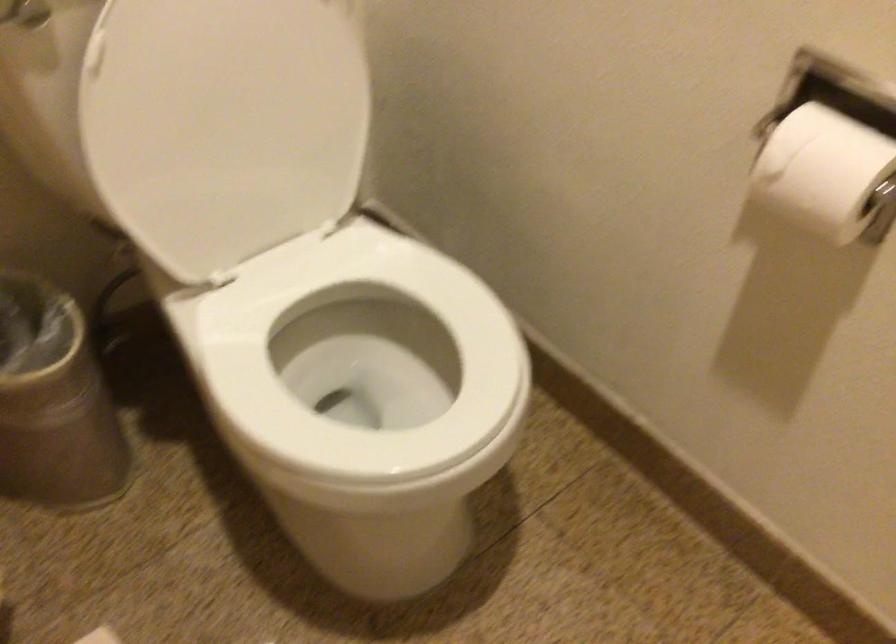
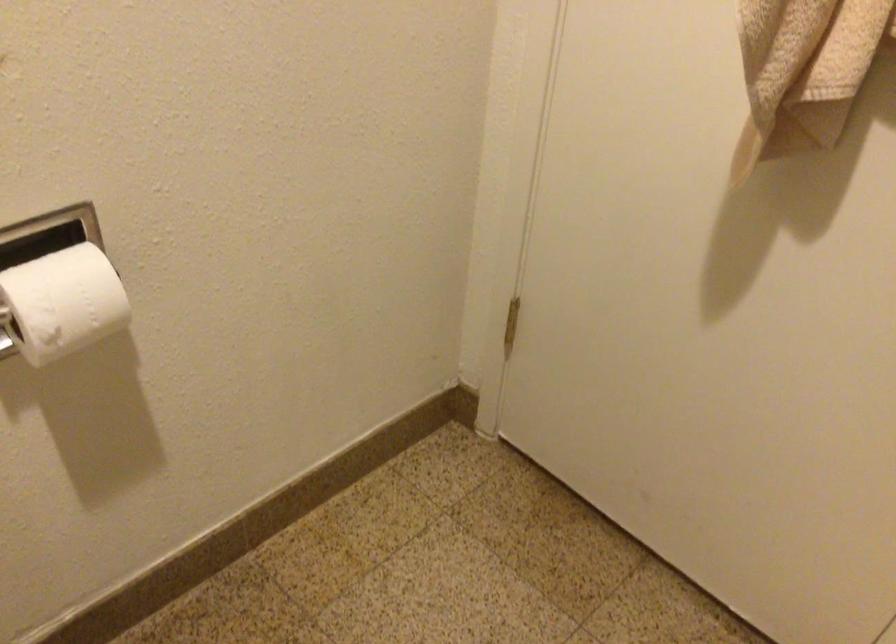
How did the camera likely rotate?

The camera rotated toward right-down.